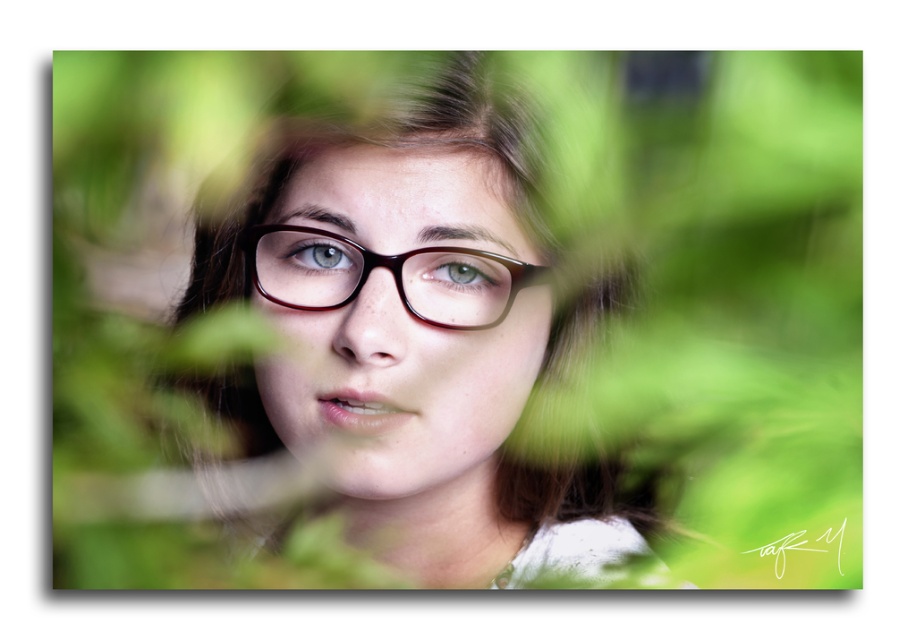
Question: Does matte brown glasses at center have a smaller size compared to brown glossy glasses at center?

Choices:
 (A) no
 (B) yes

Answer: (A)

Question: Is matte brown glasses at center positioned in front of brown glossy glasses at center?

Choices:
 (A) no
 (B) yes

Answer: (B)

Question: Observing the image, what is the correct spatial positioning of matte brown glasses at center in reference to brown glossy glasses at center?

Choices:
 (A) above
 (B) below

Answer: (B)

Question: Among these points, which one is nearest to the camera?

Choices:
 (A) (463, 301)
 (B) (358, 305)

Answer: (B)

Question: Which point is farther to the camera?

Choices:
 (A) matte brown glasses at center
 (B) brown glossy glasses at center

Answer: (B)

Question: Which point is closer to the camera taking this photo?

Choices:
 (A) (409, 296)
 (B) (404, 145)

Answer: (A)